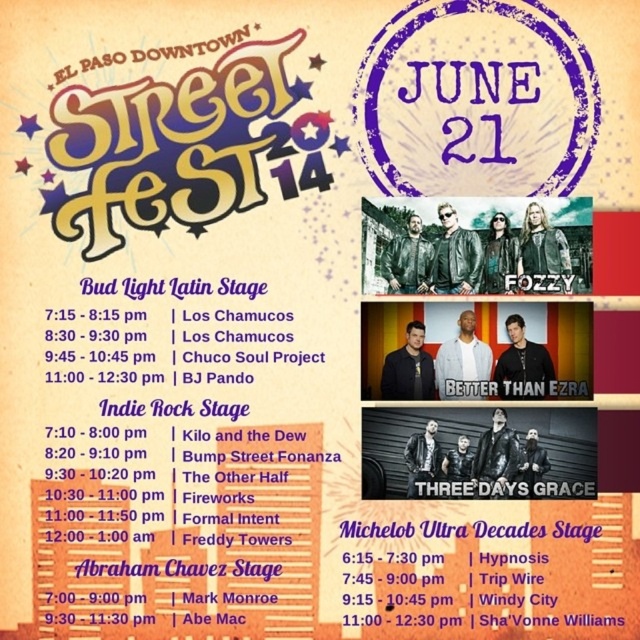
Does michelob ultra decades stage at center appear under blacktexturedbetter than ezra at center?

Correct, michelob ultra decades stage at center is located below blacktexturedbetter than ezra at center.

The image size is (640, 640). Find the location of `michelob ultra decades stage at center`. michelob ultra decades stage at center is located at coordinates (518, 579).

Who is higher up, purple paper stage at center or michelob ultra decades stage at center?

Positioned higher is purple paper stage at center.

Identify the location of purple paper stage at center. (177, 461).

Is purple paper stage at center below leather jackets at center?

Correct, purple paper stage at center is located below leather jackets at center.

Does purple paper stage at center have a lesser height compared to leather jackets at center?

No, purple paper stage at center is not shorter than leather jackets at center.

Is point (186, 636) farther from viewer compared to point (387, 241)?

No, (186, 636) is closer to viewer.

The image size is (640, 640). What are the coordinates of `purple paper stage at center` in the screenshot? It's located at (177, 461).